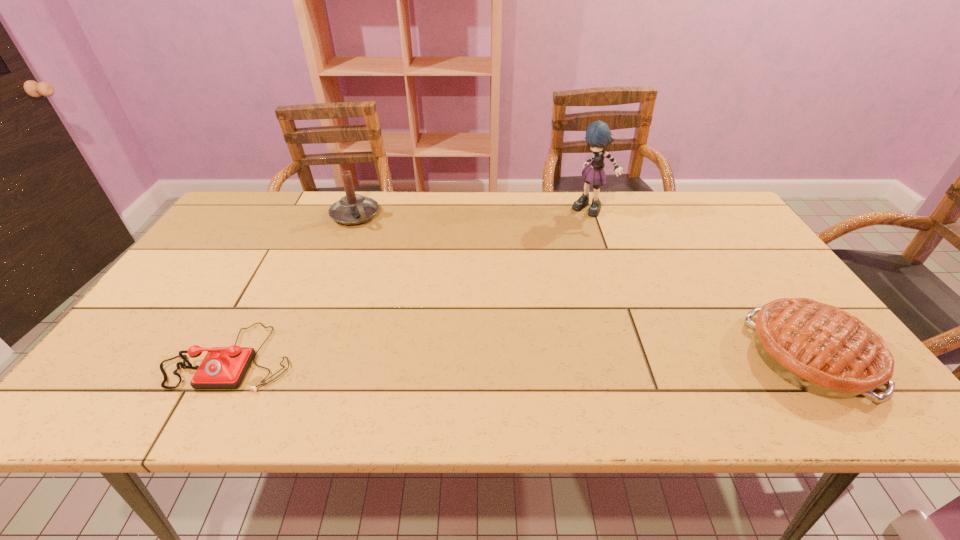
Find the location of `free space located 0.370m on the front-facing side of the tallest object`. free space located 0.370m on the front-facing side of the tallest object is located at coordinates (545, 288).

Where is `free spot located on the front-facing side of the tallest object`? free spot located on the front-facing side of the tallest object is located at coordinates (559, 264).

This screenshot has width=960, height=540. Find the location of `vacant area located on the front-facing side of the tallest object`. vacant area located on the front-facing side of the tallest object is located at coordinates (551, 276).

This screenshot has width=960, height=540. In order to click on candle positioned at the far edge in this screenshot , I will do `click(352, 209)`.

I want to click on rag doll that is at the far edge, so click(598, 135).

This screenshot has height=540, width=960. What are the coordinates of `telephone positioned at the near edge` in the screenshot? It's located at (223, 367).

What are the coordinates of `pie that is at the near edge` in the screenshot? It's located at coord(821,349).

The image size is (960, 540). In order to click on object present at the left edge in this screenshot , I will do `click(223, 367)`.

Find the location of `object at the right edge`. object at the right edge is located at coordinates (821, 349).

Find the location of a particular element. Image resolution: width=960 pixels, height=540 pixels. object located at the near left corner is located at coordinates (223, 367).